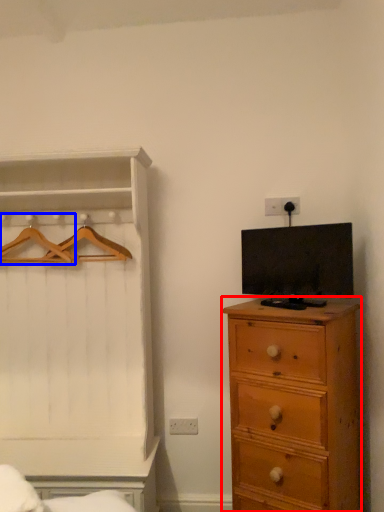
Question: Which object is closer to the camera taking this photo, chest of drawers (highlighted by a red box) or hanger (highlighted by a blue box)?

Choices:
 (A) chest of drawers
 (B) hanger

Answer: (A)